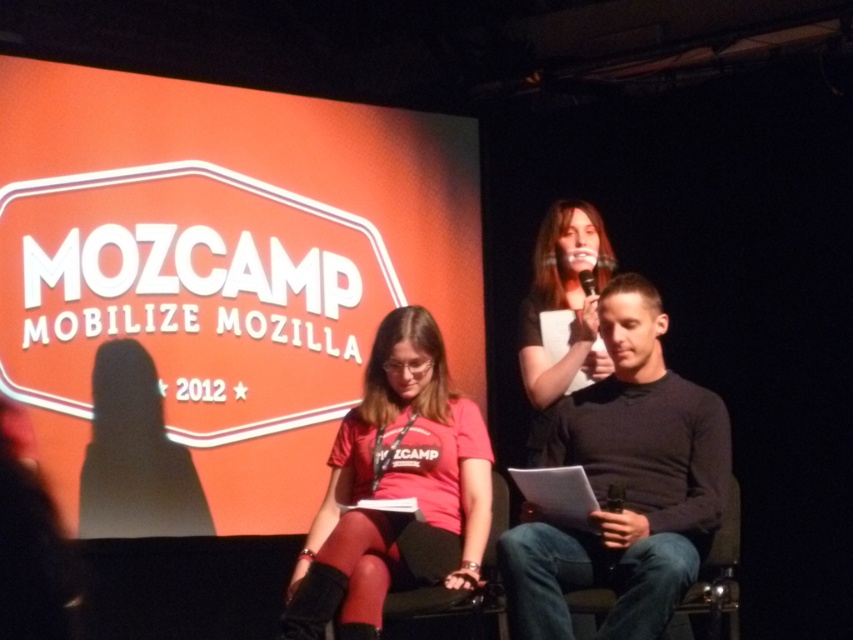
You are an event organizer setting up for the MOZCAMP 2012 conference. You have a matte black microphone at upper center and a denim fabric chair at center. Which object is bigger?

The matte black microphone at upper center is larger in size compared to the denim fabric chair at center.